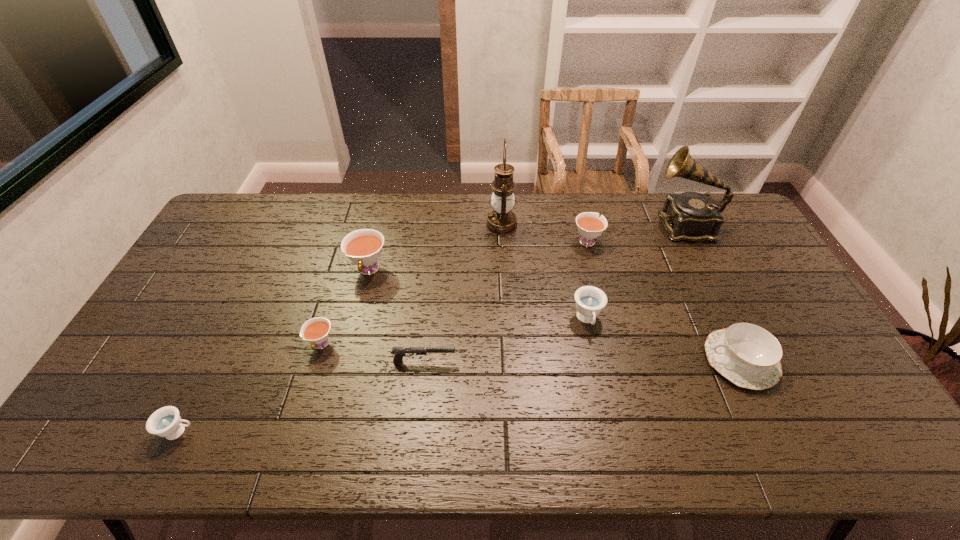
Identify the location of blank area located 0.060m on the side of the second smallest white teacup with the handle. (582, 219).

Where is `free space located on the side of the second smallest white teacup with the handle`? Image resolution: width=960 pixels, height=540 pixels. free space located on the side of the second smallest white teacup with the handle is located at coordinates (577, 202).

Locate an element on the screen. vacant space located on the side of the second smallest white teacup with the handle is located at coordinates (582, 219).

You are a GUI agent. You are given a task and a screenshot of the screen. Output one action in this format:
    pyautogui.click(x=<x>, y=<y>)
    Task: Click on the vacant space located on the side of the right blue teacup with the handle
    The image size is (960, 540).
    Given the screenshot: What is the action you would take?
    pyautogui.click(x=597, y=367)

At what (x,y) coordinates should I click in order to perform the action: click on blank space located 0.290m on the handle side of the chinaware. Please return your answer as a coordinate pair (x, y). The height and width of the screenshot is (540, 960). Looking at the image, I should click on (598, 360).

You are a GUI agent. You are given a task and a screenshot of the screen. Output one action in this format:
    pyautogui.click(x=<x>, y=<y>)
    Task: Click on the vacant position located on the handle side of the chinaware
    This screenshot has width=960, height=540.
    Given the screenshot: What is the action you would take?
    pyautogui.click(x=672, y=360)

Find the location of `free location located on the handle side of the chinaware`. free location located on the handle side of the chinaware is located at coordinates click(x=657, y=360).

You are a GUI agent. You are given a task and a screenshot of the screen. Output one action in this format:
    pyautogui.click(x=<x>, y=<y>)
    Task: Click on the vacant space located on the side of the smallest white teacup with the handle
    The height and width of the screenshot is (540, 960).
    Given the screenshot: What is the action you would take?
    pyautogui.click(x=293, y=437)

The height and width of the screenshot is (540, 960). Identify the location of free space located at the muzzle end of the fourth object from left to right. (588, 362).

The image size is (960, 540). In order to click on free space located on the side of the nearest teacup with the handle in this screenshot , I will do `click(341, 431)`.